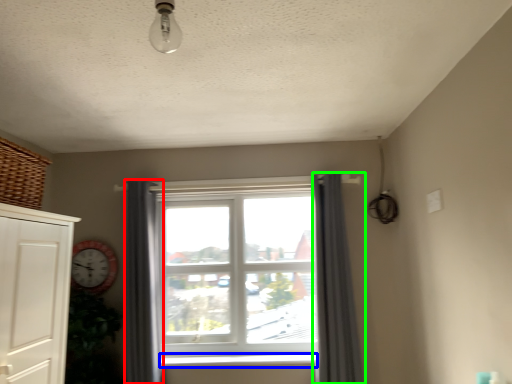
Question: Based on their relative distances, which object is nearer to curtain (highlighted by a red box)? Choose from window sill (highlighted by a blue box) and curtain (highlighted by a green box).

Choices:
 (A) window sill
 (B) curtain

Answer: (A)